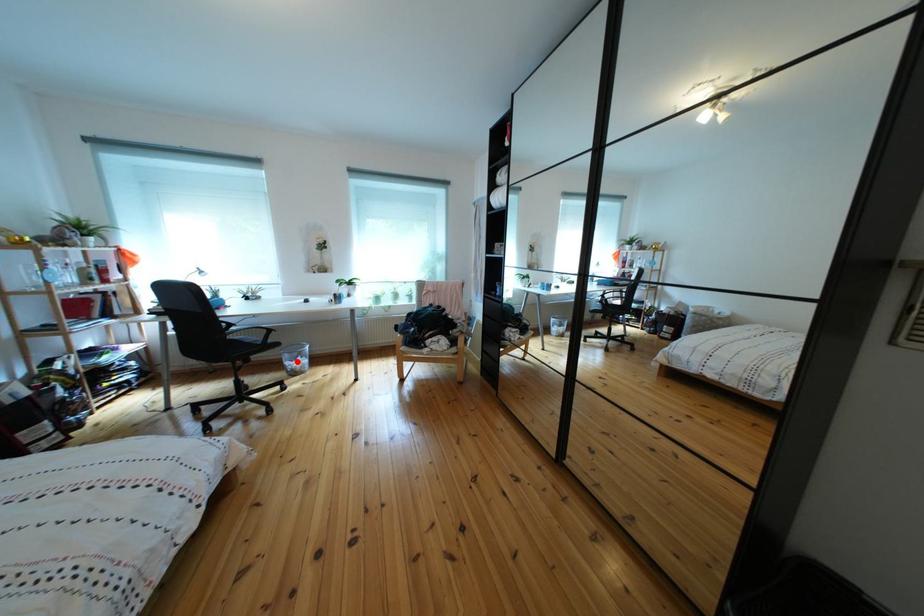
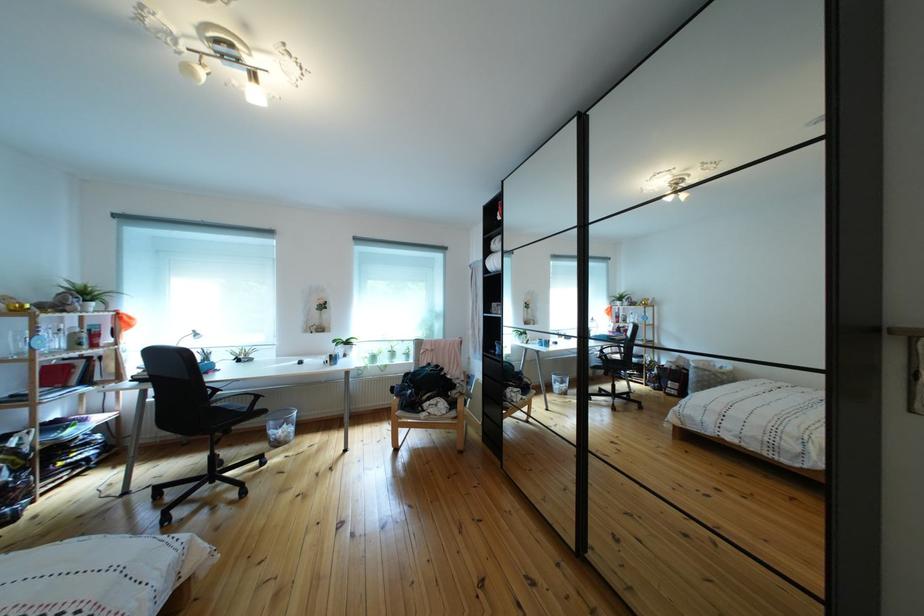
In the second image, find the point that corresponds to the highlighted location in the first image.

(283, 430)